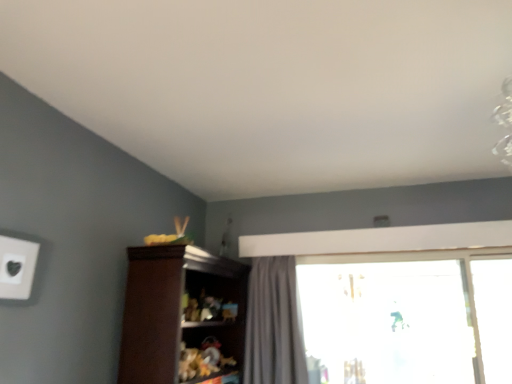
Question: In the image, is white matte electric outlet at upper left on the left side or the right side of brown wood cupboard at center?

Choices:
 (A) left
 (B) right

Answer: (A)

Question: In terms of height, does white matte electric outlet at upper left look taller or shorter compared to brown wood cupboard at center?

Choices:
 (A) short
 (B) tall

Answer: (A)

Question: Based on their relative distances, which object is nearer to the white matte electric outlet at upper left?

Choices:
 (A) brown wood cupboard at center
 (B) gray fabric curtain at center
 (C) transparent glass window at center

Answer: (A)

Question: Which object is the farthest from the white matte electric outlet at upper left?

Choices:
 (A) gray fabric curtain at center
 (B) brown wood cupboard at center
 (C) transparent glass window at center

Answer: (C)